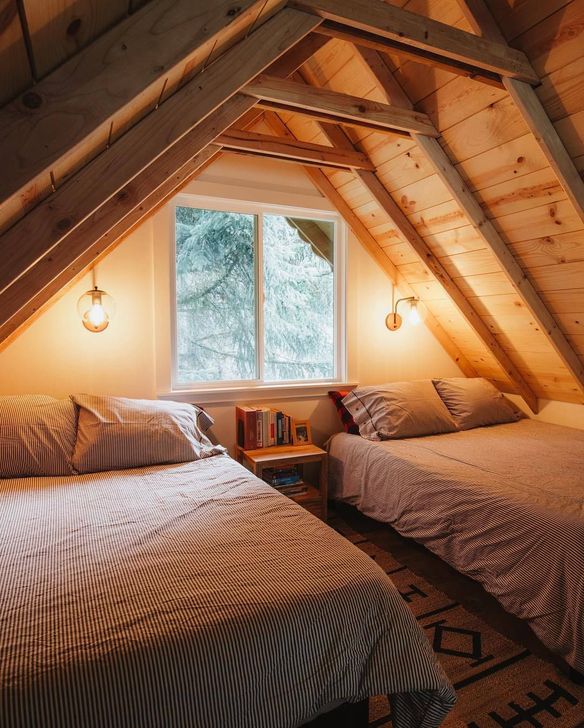
Locate an element on the screen. book shelf is located at coordinates (272, 458).